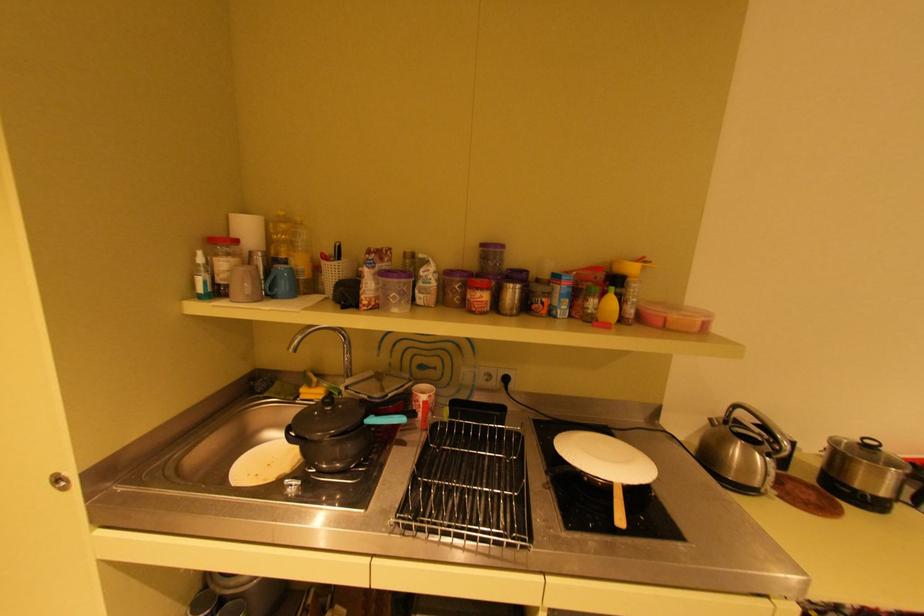
Find where to lift the turquoise pot handle. Please return your answer as a coordinate pair (x, y).

(386, 419)